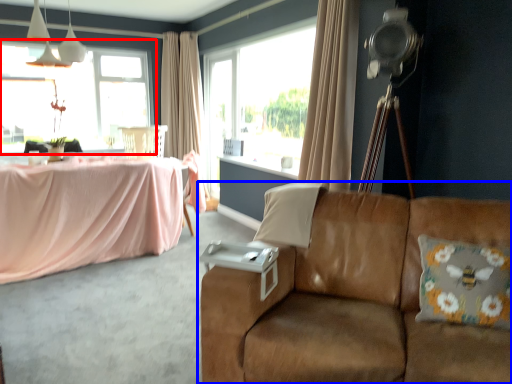
Question: Among these objects, which one is nearest to the camera, window (highlighted by a red box) or studio couch (highlighted by a blue box)?

Choices:
 (A) window
 (B) studio couch

Answer: (B)